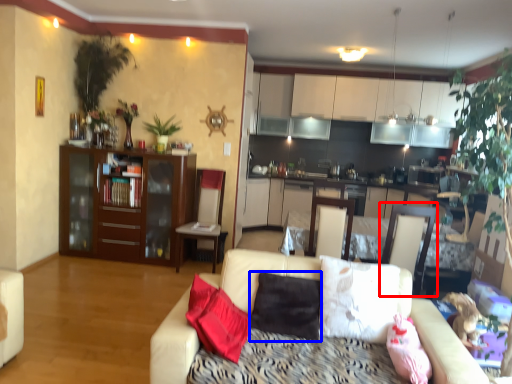
Question: Which object is further to the camera taking this photo, armchair (highlighted by a red box) or pillow (highlighted by a blue box)?

Choices:
 (A) armchair
 (B) pillow

Answer: (A)